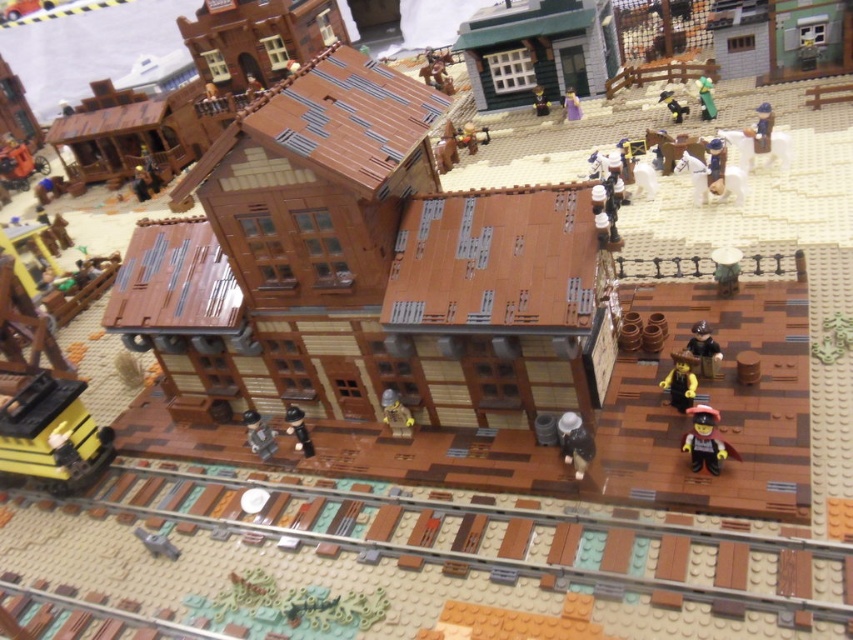
Question: Which point is farther from the camera taking this photo?

Choices:
 (A) (666, 97)
 (B) (720, 289)

Answer: (A)

Question: Is brown wooden building at center positioned in front of smooth brown hat at upper center?

Choices:
 (A) yes
 (B) no

Answer: (A)

Question: Observing the image, what is the correct spatial positioning of matte black cowboy hat at lower center in reference to purple fabric dress at upper center?

Choices:
 (A) left
 (B) right

Answer: (A)

Question: Which of the following is the closest to the observer?

Choices:
 (A) (686, 371)
 (B) (704, 417)

Answer: (B)

Question: Is brown wooden building at center above blue plastic figure at upper right?

Choices:
 (A) yes
 (B) no

Answer: (B)

Question: Which object is farther from the camera taking this photo?

Choices:
 (A) smooth brown hat at upper center
 (B) brown matte minifigure at center
 (C) brown wooden building at center
 (D) yellow plastic cowboy hat at upper right

Answer: (A)